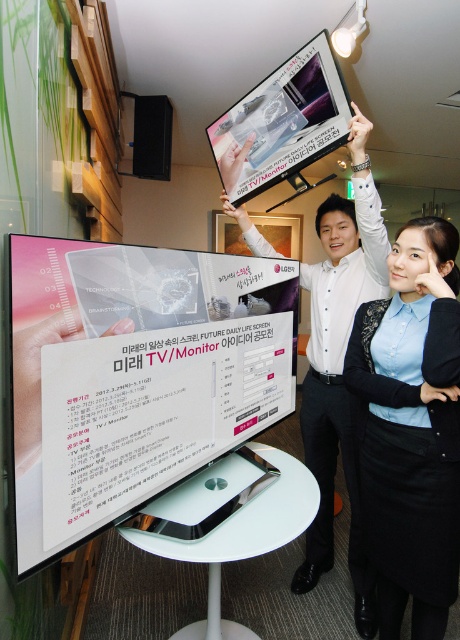
Question: Among these objects, which one is nearest to the camera?

Choices:
 (A) satin black monitor at upper center
 (B) white glossy monitor at upper center
 (C) blue fabric shirt at upper right

Answer: (C)

Question: Among these objects, which one is farthest from the camera?

Choices:
 (A) blue fabric shirt at upper right
 (B) satin black monitor at upper center

Answer: (B)

Question: Can you confirm if metallic silver monitor at center is positioned above white glossy screen at left?

Choices:
 (A) no
 (B) yes

Answer: (A)

Question: Is white glossy monitor at upper center to the right of satin black monitor at upper center from the viewer's perspective?

Choices:
 (A) no
 (B) yes

Answer: (B)

Question: Is metallic silver monitor at center below white glossy screen at left?

Choices:
 (A) yes
 (B) no

Answer: (A)

Question: Which point is closer to the camera?

Choices:
 (A) white glossy monitor at upper center
 (B) satin black monitor at upper center
 (C) metallic silver monitor at center

Answer: (C)